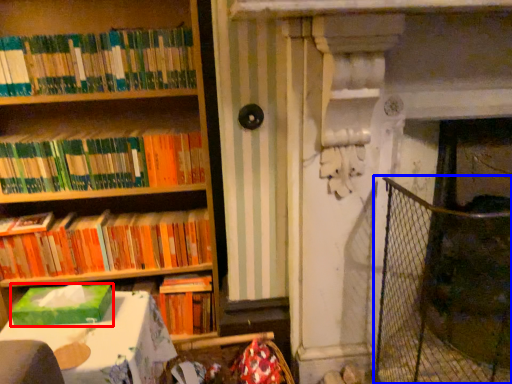
Question: Among these objects, which one is farthest to the camera, paperback book (highlighted by a red box) or fence (highlighted by a blue box)?

Choices:
 (A) paperback book
 (B) fence

Answer: (B)